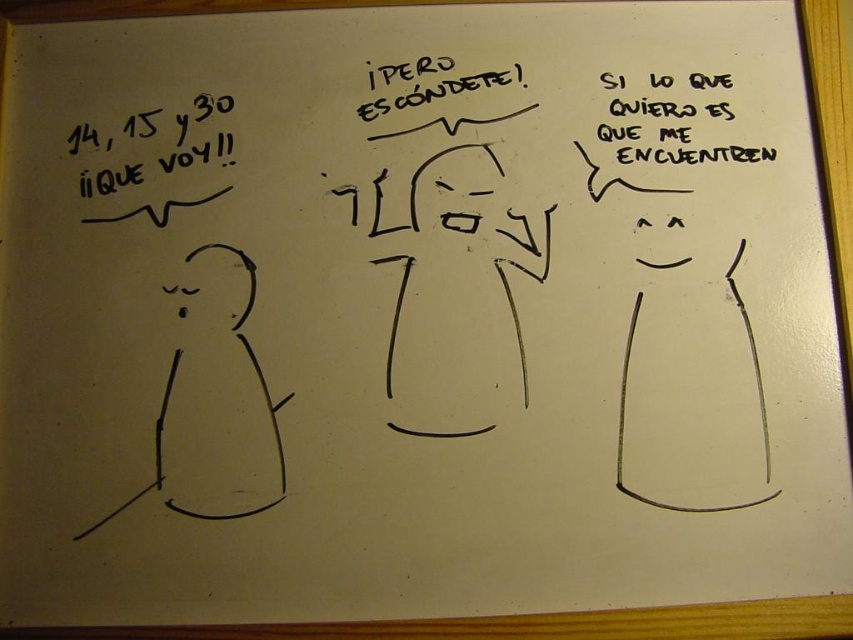
Question: In this image, where is black paper text at upper right located relative to black marker text at center?

Choices:
 (A) right
 (B) left

Answer: (A)

Question: Which object appears closest to the camera in this image?

Choices:
 (A) black marker text at center
 (B) black paper text at upper right

Answer: (B)

Question: Observing the image, what is the correct spatial positioning of black paper text at upper right in reference to black marker text at center?

Choices:
 (A) below
 (B) above

Answer: (A)

Question: Considering the relative positions of black paper text at upper right and black marker text at center in the image provided, where is black paper text at upper right located with respect to black marker text at center?

Choices:
 (A) left
 (B) right

Answer: (B)

Question: Which point is farther from the camera taking this photo?

Choices:
 (A) (395, 97)
 (B) (683, 112)

Answer: (A)